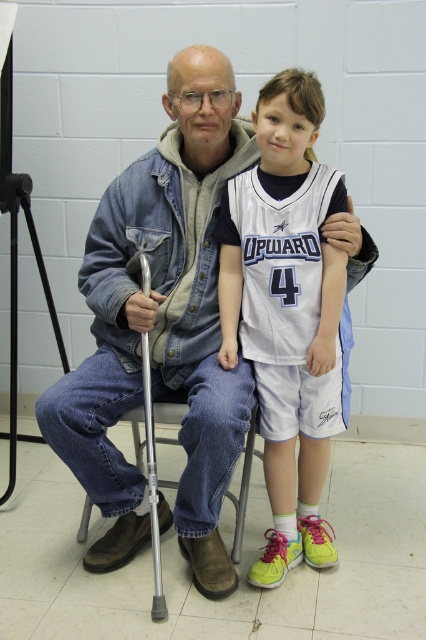
Question: Where is white jersey at center located in relation to silver metallic crutch at left in the image?

Choices:
 (A) below
 (B) above

Answer: (B)

Question: Considering the real-world distances, which object is farthest from the silver metallic crutch at left?

Choices:
 (A) white jersey at center
 (B) denim jacket at center

Answer: (A)

Question: Is denim jacket at center smaller than white jersey at center?

Choices:
 (A) yes
 (B) no

Answer: (B)

Question: Among these points, which one is nearest to the camera?

Choices:
 (A) (158, 557)
 (B) (270, 154)
 (C) (114, 544)

Answer: (B)

Question: Is white jersey at center closer to camera compared to silver metallic crutch at left?

Choices:
 (A) no
 (B) yes

Answer: (A)

Question: Which point is farther from the camera taking this photo?

Choices:
 (A) (163, 595)
 (B) (206, 99)

Answer: (A)